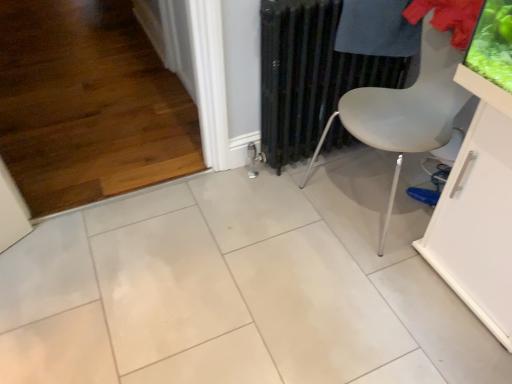
I want to click on free region on the left part of blue fabric shoe at lower right, so click(398, 193).